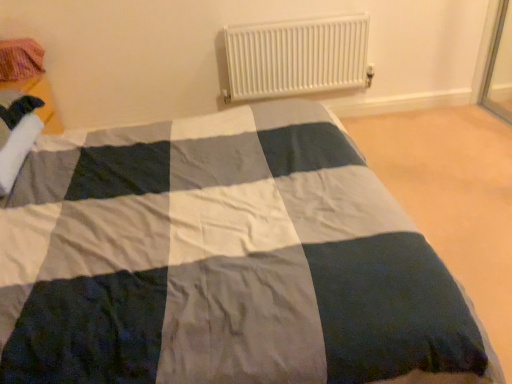
Question: From the image's perspective, is pink knitted fabric at upper left above or below white plastic radiator at upper center?

Choices:
 (A) below
 (B) above

Answer: (A)

Question: Is pink knitted fabric at upper left inside or outside of white plastic radiator at upper center?

Choices:
 (A) outside
 (B) inside

Answer: (A)

Question: Is point (13, 74) closer or farther from the camera than point (243, 77)?

Choices:
 (A) closer
 (B) farther

Answer: (A)

Question: Considering the relative positions of white plastic radiator at upper center and pink knitted fabric at upper left in the image provided, is white plastic radiator at upper center to the left or to the right of pink knitted fabric at upper left?

Choices:
 (A) right
 (B) left

Answer: (A)

Question: Relative to pink knitted fabric at upper left, is white plastic radiator at upper center in front or behind?

Choices:
 (A) behind
 (B) front

Answer: (A)

Question: Considering the positions of white plastic radiator at upper center and pink knitted fabric at upper left in the image, is white plastic radiator at upper center taller or shorter than pink knitted fabric at upper left?

Choices:
 (A) short
 (B) tall

Answer: (B)

Question: From a real-world perspective, is white plastic radiator at upper center physically located above or below pink knitted fabric at upper left?

Choices:
 (A) above
 (B) below

Answer: (B)